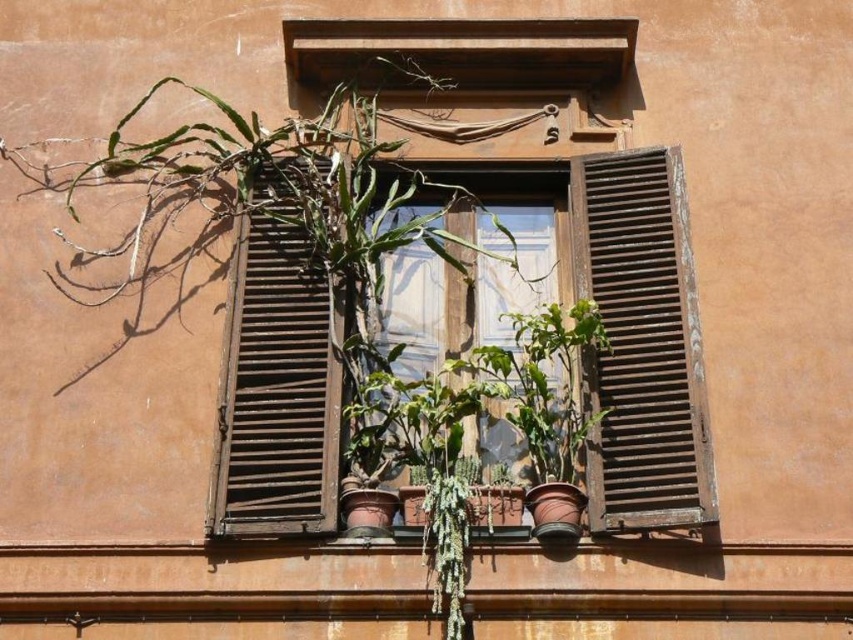
Question: Which point appears farthest from the camera in this image?

Choices:
 (A) (165, 211)
 (B) (653, 432)

Answer: (A)

Question: Which object appears closest to the camera in this image?

Choices:
 (A) green matte plant at left
 (B) wooden at center
 (C) wooden at right

Answer: (C)

Question: Is green matte plant at left below wooden at right?

Choices:
 (A) no
 (B) yes

Answer: (A)

Question: Which point is farther to the camera?

Choices:
 (A) (109, 166)
 (B) (320, 528)
 (C) (699, 337)

Answer: (A)

Question: Does green matte plant at left come behind wooden at right?

Choices:
 (A) no
 (B) yes

Answer: (B)

Question: Is green matte plant at left behind wooden at right?

Choices:
 (A) no
 (B) yes

Answer: (B)